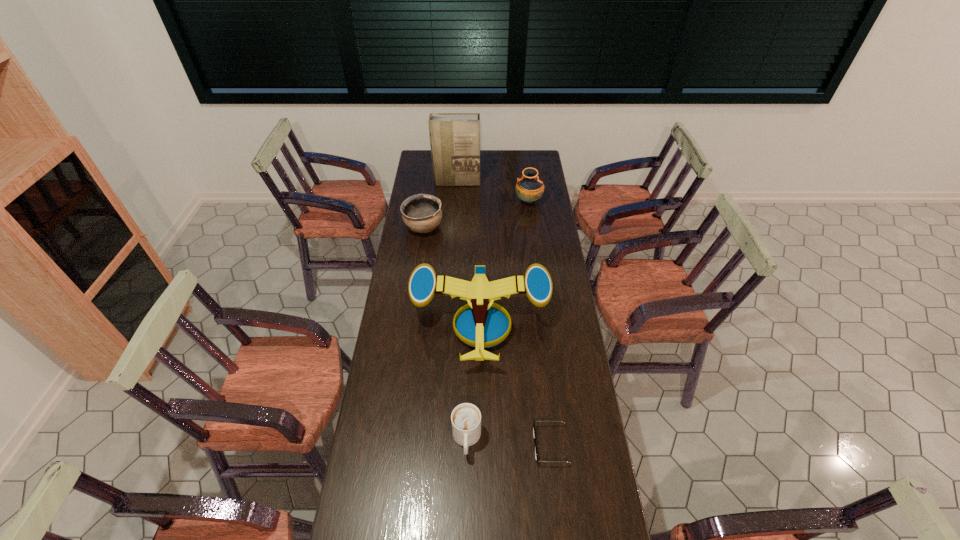
This screenshot has height=540, width=960. Identify the location of the third closest object to the shorter pottery. (529, 188).

At what (x,y) coordinates should I click in order to perform the action: click on object that stands as the fifth closest to the fourth farthest object. Please return your answer as a coordinate pair (x, y). The height and width of the screenshot is (540, 960). Looking at the image, I should click on (454, 137).

I want to click on vacant space that satisfies the following two spatial constraints: 1. on the cover of the tallest object; 2. on the left side of the farther pottery, so click(x=456, y=202).